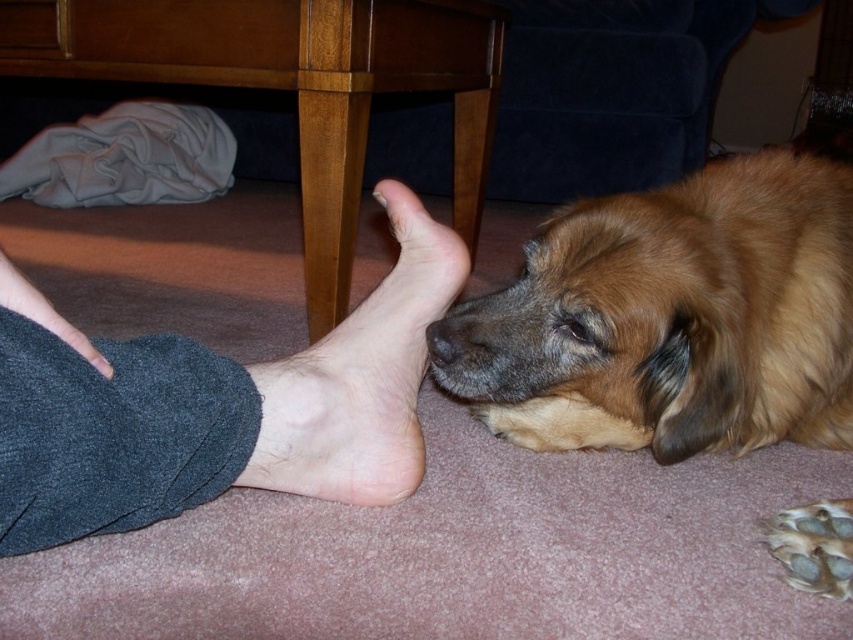
From the picture: You are looking at the image and see two points marked in the scene. The first point is at coordinates point (432, 353) and the second point is at coordinates point (91, 355). Which of these two points is closer to you?

Point (91, 355) is closer to you because it is located behind point (432, 353) in the image.

You are a photographer trying to capture a clear shot of the golden fur dog at lower right and the pink flesh at center. Which object should you focus on first to ensure both are in focus?

You should focus on the golden fur dog at lower right first because it is closer to the viewer than the pink flesh at center. By focusing on the closer object, the depth of field may allow the pink flesh at center to also be in focus.